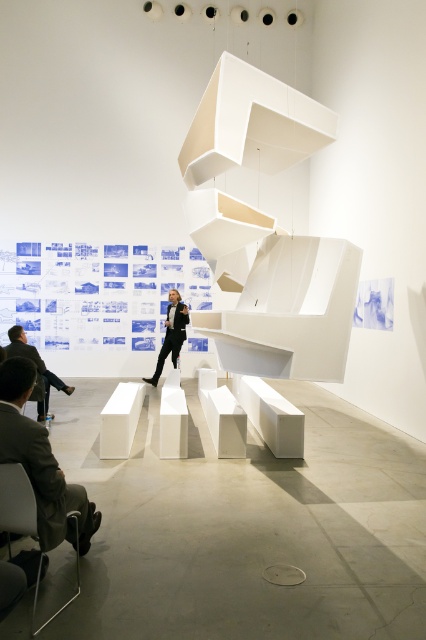
You are standing in the exhibition space and want to move from the entrance to the sculpture. You see two points marked in the image, point (17, 346) and point (152, 385). Which point is closer to you as you face the sculpture?

Point (17, 346) is in front of point (152, 385), so it is closer to you as you face the sculpture.

You are an event planner preparing for a presentation. You need to place a 1.8 meters tall speaker podium next to the metallic gray chair at lower left and the black suit at center. Will the podium be taller than both objects?

The metallic gray chair at lower left has a lesser height compared to black suit at center. However, the height of the black suit at center is not provided. Therefore, it is uncertain if the 1.8 meters tall speaker podium will be taller than both objects.

You are a visitor at the exhibition and want to sit down on the metallic gray chair at lower left without blocking the view of the black suit at center. Is the current arrangement allowing you to do that?

The metallic gray chair at lower left is in front of the black suit at center, so sitting on it would block the view of the black suit at center. Therefore, you cannot sit there without obstructing the view.